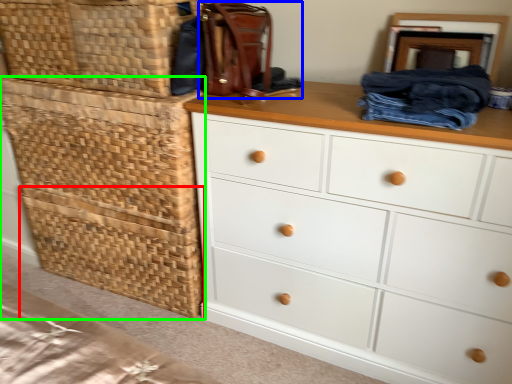
Question: Based on their relative distances, which object is nearer to basket (highlighted by a red box)? Choose from handbag (highlighted by a blue box) and crate (highlighted by a green box).

Choices:
 (A) handbag
 (B) crate

Answer: (B)